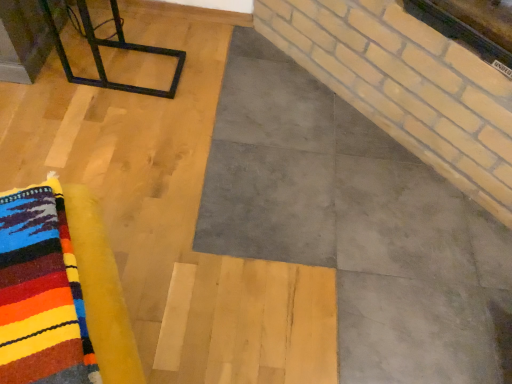
Question: From the image's perspective, would you say black metal frame at upper left is shown under multicolored wool rug at lower left?

Choices:
 (A) yes
 (B) no

Answer: (B)

Question: Is black metal frame at upper left placed right next to multicolored wool rug at lower left?

Choices:
 (A) no
 (B) yes

Answer: (A)

Question: Is black metal frame at upper left facing away from multicolored wool rug at lower left?

Choices:
 (A) yes
 (B) no

Answer: (B)

Question: From the image's perspective, would you say black metal frame at upper left is positioned over multicolored wool rug at lower left?

Choices:
 (A) no
 (B) yes

Answer: (B)

Question: Does black metal frame at upper left have a greater width compared to multicolored wool rug at lower left?

Choices:
 (A) no
 (B) yes

Answer: (B)

Question: Is black metal frame at upper left positioned before multicolored wool rug at lower left?

Choices:
 (A) yes
 (B) no

Answer: (B)

Question: Is the surface of multicolored wool rug at lower left in direct contact with black metal frame at upper left?

Choices:
 (A) yes
 (B) no

Answer: (B)

Question: Considering the relative sizes of multicolored wool rug at lower left and black metal frame at upper left in the image provided, is multicolored wool rug at lower left bigger than black metal frame at upper left?

Choices:
 (A) yes
 (B) no

Answer: (B)

Question: Is multicolored wool rug at lower left looking in the opposite direction of black metal frame at upper left?

Choices:
 (A) no
 (B) yes

Answer: (A)

Question: Is multicolored wool rug at lower left taller than black metal frame at upper left?

Choices:
 (A) no
 (B) yes

Answer: (B)

Question: Could you tell me if multicolored wool rug at lower left is facing black metal frame at upper left?

Choices:
 (A) yes
 (B) no

Answer: (B)

Question: From the image's perspective, would you say multicolored wool rug at lower left is positioned over black metal frame at upper left?

Choices:
 (A) no
 (B) yes

Answer: (A)

Question: From a real-world perspective, relative to multicolored wool rug at lower left, is black metal frame at upper left vertically above or below?

Choices:
 (A) below
 (B) above

Answer: (A)